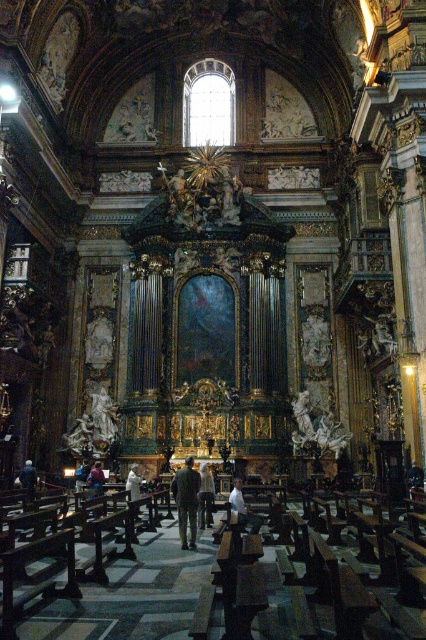
Question: Observing the image, what is the correct spatial positioning of dark blue fabric coat at center in reference to blue fabric person at center?

Choices:
 (A) below
 (B) above

Answer: (B)

Question: Which point is closer to the camera taking this photo?

Choices:
 (A) (129, 472)
 (B) (247, 518)
 (C) (29, 483)

Answer: (B)

Question: Is white matte shirt at center positioned in front of white clothed figure at center?

Choices:
 (A) no
 (B) yes

Answer: (A)

Question: Estimate the real-world distances between objects in this image. Which object is closer to the dark brown leather jacket at center?

Choices:
 (A) light beige fabric coat at center
 (B) blue fabric person at center
 (C) dark blue fabric coat at center
 (D) white clothed figure at center

Answer: (A)

Question: Is white matte shirt at center below blue fabric person at center?

Choices:
 (A) yes
 (B) no

Answer: (B)

Question: Which object appears farthest from the camera in this image?

Choices:
 (A) dark brown leather jacket at center
 (B) dark blue fabric coat at center
 (C) white clothed figure at center

Answer: (B)